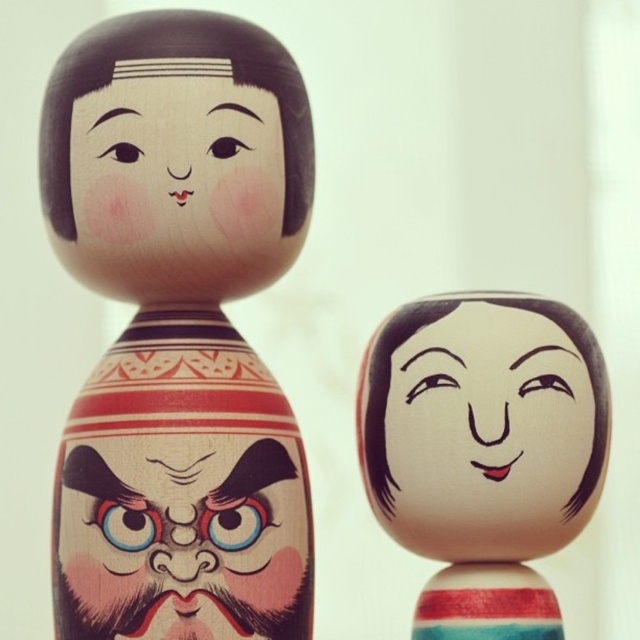
In the scene shown: You are an art curator arranging an exhibition. You have a wooden doll at center and a smooth beige face at center. Which object should you place higher on the display shelf to ensure the taller object is visible?

The wooden doll at center is taller than the smooth beige face at center, so you should place the wooden doll at center higher on the display shelf to ensure it is visible.

You are an artist trying to create a miniature version of the wooden doll at center and the smooth beige face at center. If you want to maintain their size relationship, which one should you make bigger?

The wooden doll at center should be made bigger than the smooth beige face at center to maintain their size relationship since it is larger in size than the smooth beige face at center.

You are an artist trying to paint a scene based on the image. You need to ensure the proportions are accurate. Which object should you paint first if you want to place the wooden painted mask at center and the smooth beige face at center in the correct vertical order?

You should paint the smooth beige face at center first because the wooden painted mask at center has a lesser height compared to it, meaning the mask is shorter and should be placed below the face to maintain the correct vertical order.